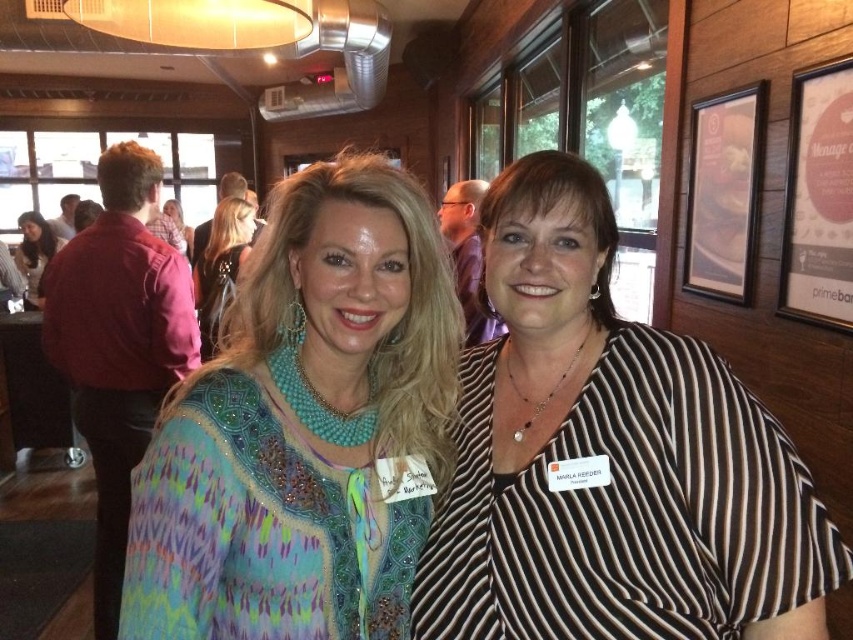
Question: Considering the relative positions of striped fabric blouse at center and teal beaded necklace at upper center in the image provided, where is striped fabric blouse at center located with respect to teal beaded necklace at upper center?

Choices:
 (A) right
 (B) left

Answer: (A)

Question: Which of these objects is positioned closest to the matte black hair at upper left?

Choices:
 (A) multicolored beaded top at center
 (B) teal beaded necklace at upper center
 (C) striped fabric blouse at center
 (D) shiny black hair at upper left

Answer: (B)

Question: Can you confirm if multicolored beaded top at center is positioned above teal beaded necklace at upper center?

Choices:
 (A) yes
 (B) no

Answer: (B)

Question: Can you confirm if multicolored beaded top at center is positioned above shiny black hair at upper left?

Choices:
 (A) no
 (B) yes

Answer: (A)

Question: Among these objects, which one is farthest from the camera?

Choices:
 (A) matte black hair at upper left
 (B) teal beaded necklace at upper center
 (C) multicolored beaded top at center
 (D) shiny black hair at upper left

Answer: (B)

Question: Which point appears farthest from the camera in this image?

Choices:
 (A) (165, 205)
 (B) (28, 269)

Answer: (A)